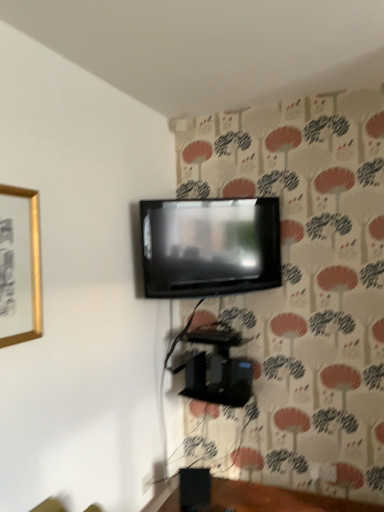
Measure the distance between point (36, 224) and camera.

Point (36, 224) is 1.61 meters from camera.

The height and width of the screenshot is (512, 384). I want to click on gold metallic picture frame at upper left, so click(x=22, y=262).

Find the location of `gold metallic picture frame at upper left`. gold metallic picture frame at upper left is located at coordinates (22, 262).

From the image's perspective, between black glossy speaker at lower center and gold metallic picture frame at upper left, which one is located above?

gold metallic picture frame at upper left appears higher in the image.

Is gold metallic picture frame at upper left at the back of black glossy speaker at lower center?

black glossy speaker at lower center does not have its back to gold metallic picture frame at upper left.

The height and width of the screenshot is (512, 384). Find the location of `furniture located behind the gold metallic picture frame at upper left`. furniture located behind the gold metallic picture frame at upper left is located at coordinates pyautogui.click(x=277, y=499).

Considering the sizes of objects black glossy speaker at lower center and gold metallic picture frame at upper left in the image provided, who is wider, black glossy speaker at lower center or gold metallic picture frame at upper left?

black glossy speaker at lower center.

Looking at their sizes, would you say matte black tv at upper center is wider or thinner than black glossy speaker at lower center?

Clearly, matte black tv at upper center has less width compared to black glossy speaker at lower center.

Considering the relative sizes of matte black tv at upper center and black glossy speaker at lower center in the image provided, is matte black tv at upper center taller than black glossy speaker at lower center?

Yes, matte black tv at upper center is taller than black glossy speaker at lower center.

Would you say matte black tv at upper center is outside black glossy speaker at lower center?

Yes, matte black tv at upper center is located beyond the bounds of black glossy speaker at lower center.

How different are the orientations of matte black tv at upper center and black glossy speaker at lower center in degrees?

37.3 degrees separate the facing orientations of matte black tv at upper center and black glossy speaker at lower center.

Is black matte speaker at lower center oriented away from black glossy speaker at lower center?

black matte speaker at lower center is not turned away from black glossy speaker at lower center.

The image size is (384, 512). I want to click on speaker that is above the black glossy speaker at lower center (from the image's perspective), so click(195, 489).

Consider the image. From the image's perspective, is black matte speaker at lower center on top of black glossy speaker at lower center?

Yes.

How many degrees apart are the facing directions of black matte speaker at lower center and black glossy speaker at lower center?

There is a 19.7-degree angle between the facing directions of black matte speaker at lower center and black glossy speaker at lower center.

From a real-world perspective, which object stands above the other?

gold metallic picture frame at upper left.

Is gold metallic picture frame at upper left positioned in front of black glossy speaker at lower center?

Yes, gold metallic picture frame at upper left is closer to the viewer.

From the image's perspective, which is below, gold metallic picture frame at upper left or black glossy speaker at lower center?

black glossy speaker at lower center appears lower in the image.

In the scene shown: Based on their positions, is black glossy speaker at lower center located to the left or right of matte black tv at upper center?

Clearly, black glossy speaker at lower center is on the right of matte black tv at upper center in the image.

Is the depth of black glossy speaker at lower center greater than that of matte black tv at upper center?

That is False.

From the image's perspective, who appears lower, black glossy speaker at lower center or matte black tv at upper center?

black glossy speaker at lower center is shown below in the image.

Considering the positions of objects matte black tv at upper center and gold metallic picture frame at upper left in the image provided, who is in front, matte black tv at upper center or gold metallic picture frame at upper left?

Positioned in front is gold metallic picture frame at upper left.

This screenshot has width=384, height=512. I want to click on picture frame located underneath the matte black tv at upper center (from a real-world perspective), so click(22, 262).

Is matte black tv at upper center looking in the opposite direction of gold metallic picture frame at upper left?

No, gold metallic picture frame at upper left is not at the back of matte black tv at upper center.

Is gold metallic picture frame at upper left taller than matte black tv at upper center?

Correct, gold metallic picture frame at upper left is much taller as matte black tv at upper center.

At what (x,y) coordinates should I click in order to perform the action: click on picture frame on the left of matte black tv at upper center. Please return your answer as a coordinate pair (x, y). Looking at the image, I should click on (22, 262).

Which of these two, gold metallic picture frame at upper left or matte black tv at upper center, is smaller?

Smaller between the two is gold metallic picture frame at upper left.

Locate an element on the screen. The image size is (384, 512). furniture located on the right of gold metallic picture frame at upper left is located at coordinates (277, 499).

This screenshot has height=512, width=384. In order to click on television behind the black glossy speaker at lower center in this screenshot , I will do `click(210, 246)`.

When comparing their distances from black matte speaker at lower center, does black glossy speaker at lower center or gold metallic picture frame at upper left seem closer?

black glossy speaker at lower center.

Looking at the image, which one is located further to black matte speaker at lower center, gold metallic picture frame at upper left or matte black tv at upper center?

The object further to black matte speaker at lower center is gold metallic picture frame at upper left.

Which object lies further to the anchor point black glossy speaker at lower center, matte black tv at upper center or gold metallic picture frame at upper left?

gold metallic picture frame at upper left is further to black glossy speaker at lower center.

Looking at the image, which one is located further to matte black tv at upper center, black matte speaker at lower center or gold metallic picture frame at upper left?

Among the two, black matte speaker at lower center is located further to matte black tv at upper center.

Based on their spatial positions, is matte black tv at upper center or black glossy speaker at lower center closer to gold metallic picture frame at upper left?

Based on the image, matte black tv at upper center appears to be nearer to gold metallic picture frame at upper left.

Estimate the real-world distances between objects in this image. Which object is closer to matte black tv at upper center, black glossy speaker at lower center or black matte speaker at lower center?

Among the two, black matte speaker at lower center is located nearer to matte black tv at upper center.

From the image, which object appears to be nearer to black matte speaker at lower center, matte black tv at upper center or black glossy speaker at lower center?

black glossy speaker at lower center lies closer to black matte speaker at lower center than the other object.

When comparing their distances from matte black tv at upper center, does black matte speaker at lower center or black glossy speaker at lower center seem further?

black glossy speaker at lower center is positioned further to the anchor matte black tv at upper center.

You are a GUI agent. You are given a task and a screenshot of the screen. Output one action in this format:
    pyautogui.click(x=<x>, y=<y>)
    Task: Click on the picture frame between matte black tv at upper center and black matte speaker at lower center in the vertical direction
    This screenshot has height=512, width=384.
    Given the screenshot: What is the action you would take?
    pyautogui.click(x=22, y=262)

Where is `speaker that lies between gold metallic picture frame at upper left and black glossy speaker at lower center from top to bottom`? This screenshot has width=384, height=512. speaker that lies between gold metallic picture frame at upper left and black glossy speaker at lower center from top to bottom is located at coordinates (195, 489).

You are a GUI agent. You are given a task and a screenshot of the screen. Output one action in this format:
    pyautogui.click(x=<x>, y=<y>)
    Task: Click on the speaker that lies between matte black tv at upper center and black glossy speaker at lower center from top to bottom
    
    Given the screenshot: What is the action you would take?
    pyautogui.click(x=195, y=489)

Identify the location of picture frame between matte black tv at upper center and black glossy speaker at lower center in the up-down direction. The height and width of the screenshot is (512, 384). pyautogui.click(x=22, y=262).